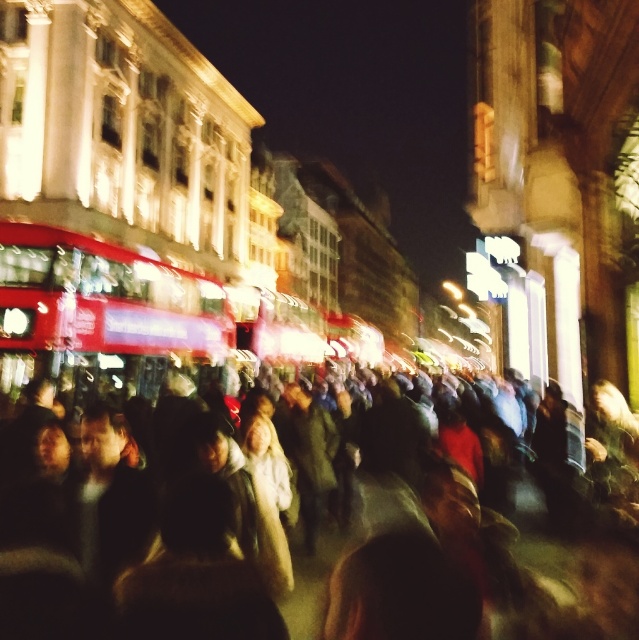
Does point (35, 602) come behind point (82, 394)?

No, it is in front of (82, 394).

Based on the photo, is multicolored fabric crowd at center further to the viewer compared to red metallic bus at center?

No, multicolored fabric crowd at center is closer to the viewer.

Between point (358, 556) and point (15, 262), which one is positioned in front?

Point (358, 556) is more forward.

I want to click on multicolored fabric crowd at center, so click(144, 532).